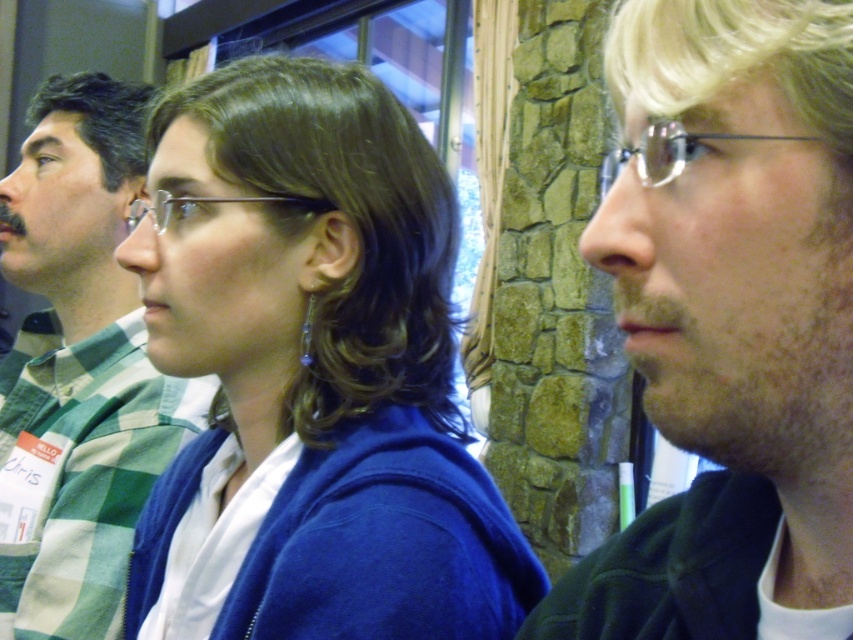
Question: Is blonde hair at right bigger than green checkered shirt at left?

Choices:
 (A) yes
 (B) no

Answer: (B)

Question: Considering the relative positions of blonde hair at right and green checkered shirt at left in the image provided, where is blonde hair at right located with respect to green checkered shirt at left?

Choices:
 (A) above
 (B) below

Answer: (B)

Question: Which object appears closest to the camera in this image?

Choices:
 (A) blonde hair at right
 (B) green checkered shirt at left

Answer: (A)

Question: Which of these objects is positioned farthest from the blonde hair at right?

Choices:
 (A) blue matte sweater at center
 (B) green checkered shirt at left

Answer: (B)

Question: Based on their relative distances, which object is farther from the blonde hair at right?

Choices:
 (A) blue matte sweater at center
 (B) green checkered shirt at left

Answer: (B)

Question: Can you confirm if blue matte sweater at center is positioned below green checkered shirt at left?

Choices:
 (A) no
 (B) yes

Answer: (B)